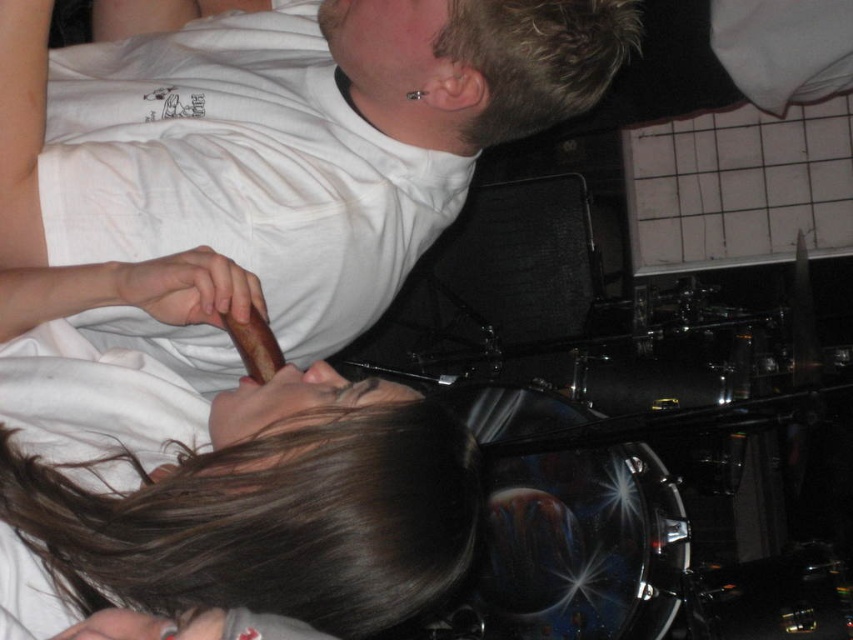
Who is lower down, brown hair at upper center or blonde hair at upper center?

brown hair at upper center is lower down.

Does brown hair at upper center have a greater height compared to blonde hair at upper center?

Indeed, brown hair at upper center has a greater height compared to blonde hair at upper center.

The image size is (853, 640). What do you see at coordinates (267, 512) in the screenshot? I see `brown hair at upper center` at bounding box center [267, 512].

You are a GUI agent. You are given a task and a screenshot of the screen. Output one action in this format:
    pyautogui.click(x=<x>, y=<y>)
    Task: Click on the brown hair at upper center
    The height and width of the screenshot is (640, 853).
    Given the screenshot: What is the action you would take?
    pyautogui.click(x=267, y=512)

Looking at this image, between white matte t-shirt at upper center and blonde hair at upper center, which one is positioned lower?

white matte t-shirt at upper center is lower down.

Measure the distance from white matte t-shirt at upper center to blonde hair at upper center.

white matte t-shirt at upper center and blonde hair at upper center are 6.43 inches apart.

Who is more distant from viewer, (363, 99) or (492, 83)?

Point (363, 99)

The width and height of the screenshot is (853, 640). Find the location of `white matte t-shirt at upper center`. white matte t-shirt at upper center is located at coordinates (283, 138).

Is white matte t-shirt at upper center thinner than brown hair at upper center?

→ No.

Who is taller, white matte t-shirt at upper center or brown hair at upper center?

Standing taller between the two is white matte t-shirt at upper center.

Who is more forward, (564, 93) or (236, 577)?

Positioned in front is point (236, 577).

The image size is (853, 640). Find the location of `white matte t-shirt at upper center`. white matte t-shirt at upper center is located at coordinates (283, 138).